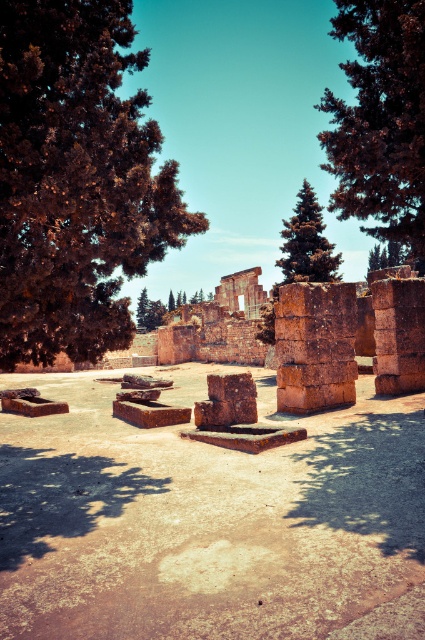
From the picture: You are standing at the archaeological site and notice two points marked in the image. The first point is at coordinates point (422, 17) and the second is at point (292, 232). From your vantage point, which point is closer to you?

Point (422, 17) is in front of point (292, 232), so the first point is closer to you.

You are an archaeologist examining the ancient site. You notice two trees in the scene. Which tree, the brown textured tree at left or the dark green textured tree at upper right, is taller?

The dark green textured tree at upper right is taller than the brown textured tree at left.